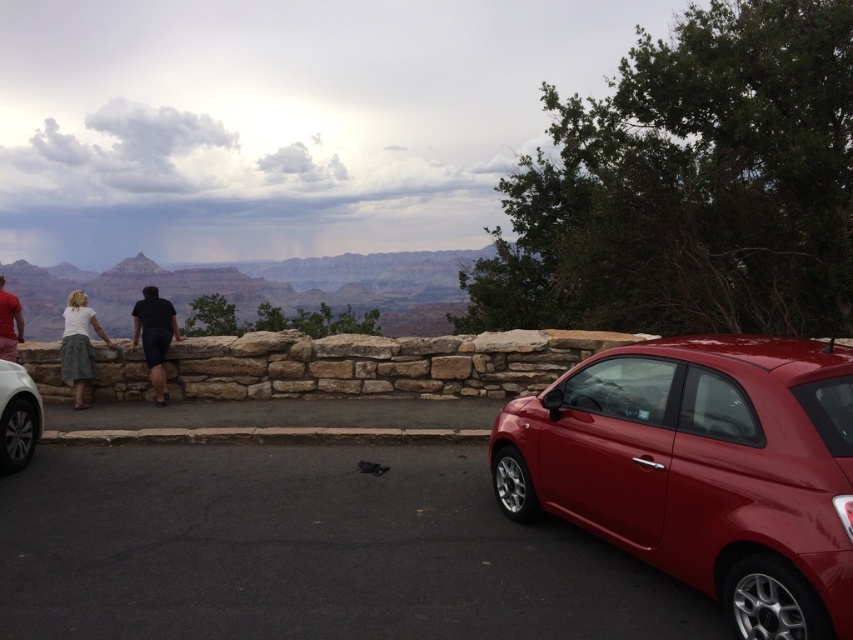
Question: Which is nearer to the black asphalt parking lot at lower right?

Choices:
 (A) matte red shirt at left
 (B) black matte shorts at center
 (C) glossy red car at lower right
 (D) white cotton shirt at center

Answer: (C)

Question: Is glossy red car at lower right above black matte shorts at center?

Choices:
 (A) no
 (B) yes

Answer: (A)

Question: Is glossy red car at lower right below matte red shirt at left?

Choices:
 (A) yes
 (B) no

Answer: (A)

Question: Observing the image, what is the correct spatial positioning of black asphalt parking lot at lower right in reference to white glossy car at lower left?

Choices:
 (A) above
 (B) below

Answer: (B)

Question: Which point is closer to the camera?

Choices:
 (A) matte red shirt at left
 (B) white glossy car at lower left
 (C) black asphalt parking lot at lower right
 (D) white cotton shirt at center

Answer: (C)

Question: Which point is farther from the camera taking this photo?

Choices:
 (A) (338, 458)
 (B) (161, 362)
 (C) (6, 340)
 (D) (700, 504)

Answer: (B)